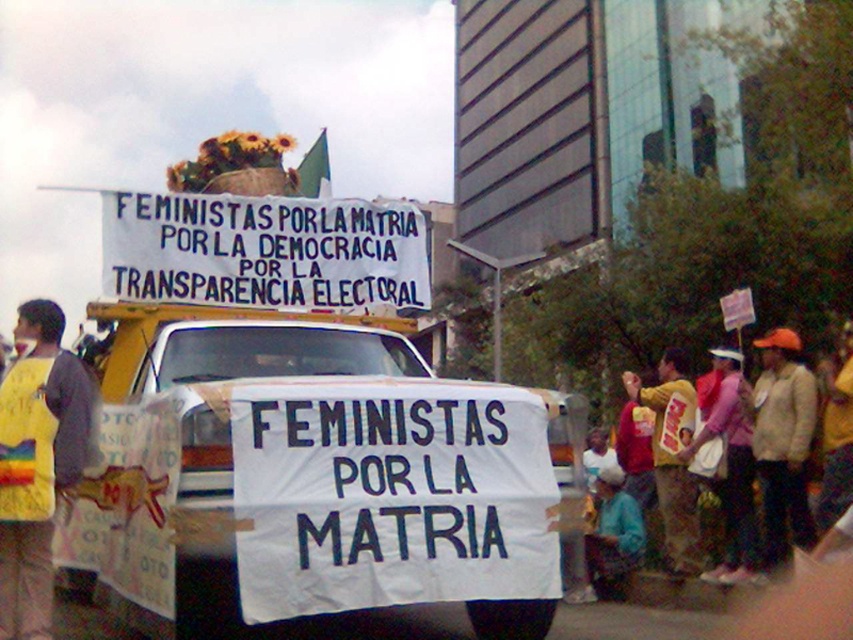
Consider the image. Which is below, yellow fabric vest at left or yellow fabric shirt at right?

yellow fabric shirt at right

Does yellow fabric vest at left appear on the right side of yellow fabric shirt at right?

Incorrect, yellow fabric vest at left is not on the right side of yellow fabric shirt at right.

Describe the element at coordinates (38, 461) in the screenshot. The image size is (853, 640). I see `yellow fabric vest at left` at that location.

Locate an element on the screen. yellow fabric vest at left is located at coordinates (38, 461).

From the picture: Can you confirm if white paper banner at center is taller than yellow fabric vest at left?

Incorrect, white paper banner at center's height is not larger of yellow fabric vest at left's.

Is white paper banner at center bigger than yellow fabric vest at left?

No, white paper banner at center is not bigger than yellow fabric vest at left.

Locate an element on the screen. The width and height of the screenshot is (853, 640). white paper banner at center is located at coordinates (229, 429).

Is pink fabric bag at lower right wider than blue fabric at lower center?

In fact, pink fabric bag at lower right might be narrower than blue fabric at lower center.

Does pink fabric bag at lower right lie in front of blue fabric at lower center?

Yes, pink fabric bag at lower right is in front of blue fabric at lower center.

The width and height of the screenshot is (853, 640). Describe the element at coordinates (727, 464) in the screenshot. I see `pink fabric bag at lower right` at that location.

At what (x,y) coordinates should I click in order to perform the action: click on pink fabric bag at lower right. Please return your answer as a coordinate pair (x, y). This screenshot has height=640, width=853. Looking at the image, I should click on (x=727, y=464).